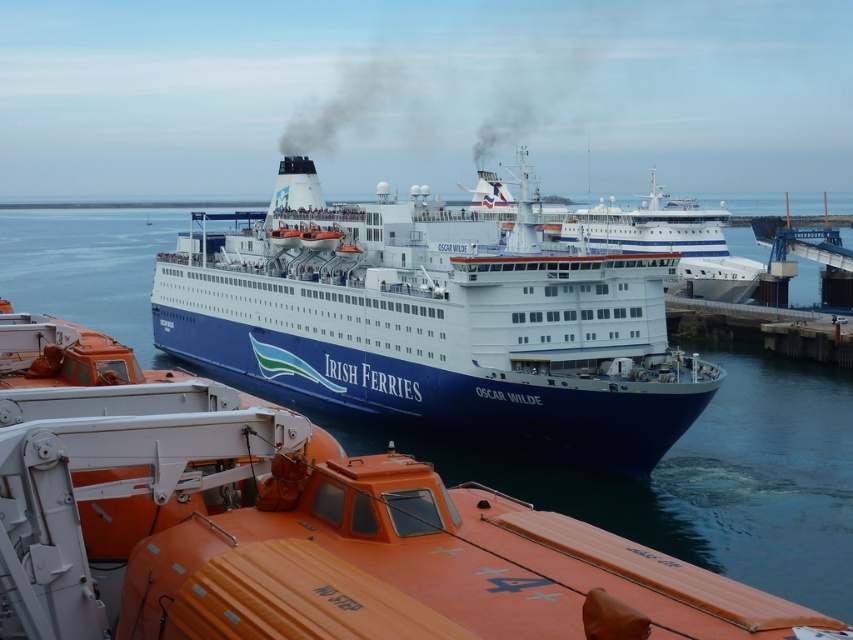
You are an observer standing on the dock and see the blue matte ferry at center and the blue water at center. Which object is positioned more to the right?

The blue matte ferry at center is positioned more to the right than the blue water at center.

From the picture: You are a port authority inspector assessing the docking area. You notice the blue matte ferry at center and the blue water at center. Which object takes up more area in the image?

The blue water at center occupies more area than the blue matte ferry at center, as the ferry occupies less space than the water.

You are standing on the deck of the ferry and want to move from the point at coordinates point (354, 422) to the point at coordinates point (531, 86). Which direction should you walk to get closer to your destination?

To move from point (354, 422) to point (531, 86), you should walk towards the direction of point (531, 86) since it is behind point (354, 422). However, based on the Objects Description, point (354, 422) is in front of point (531, 86). This means that point (531, 86) is located behind point (354, 422) from the observer perspective. Therefore, you need to walk backward or move in the direction away from the front to reach your destination.